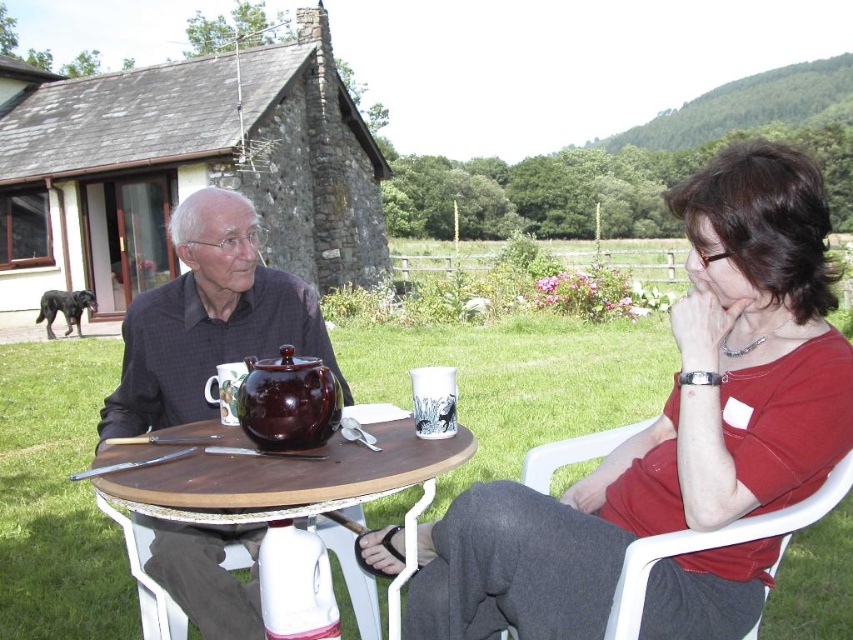
Does matte red shirt at center have a greater height compared to brown glossy teapot at center?

Correct, matte red shirt at center is much taller as brown glossy teapot at center.

Does point (527, 612) come farther from viewer compared to point (283, 394)?

No, it is in front of (283, 394).

Between point (798, 388) and point (335, 380), which one is positioned behind?

The point (335, 380) is behind.

The image size is (853, 640). Find the location of `matte red shirt at center`. matte red shirt at center is located at coordinates (671, 420).

Is matte black shirt at center positioned before white plastic chair at right?

No.

Can you confirm if matte black shirt at center is positioned to the right of white plastic chair at right?

In fact, matte black shirt at center is to the left of white plastic chair at right.

Between point (212, 337) and point (543, 465), which one is positioned behind?

The point (212, 337) is behind.

This screenshot has width=853, height=640. What are the coordinates of `matte black shirt at center` in the screenshot? It's located at (207, 320).

Is brown ceramic table at center above brown glossy teapot at center?

Actually, brown ceramic table at center is below brown glossy teapot at center.

Which is in front, point (225, 444) or point (260, 365)?

Point (260, 365) is in front.

Where is `brown ceramic table at center`? brown ceramic table at center is located at coordinates (291, 477).